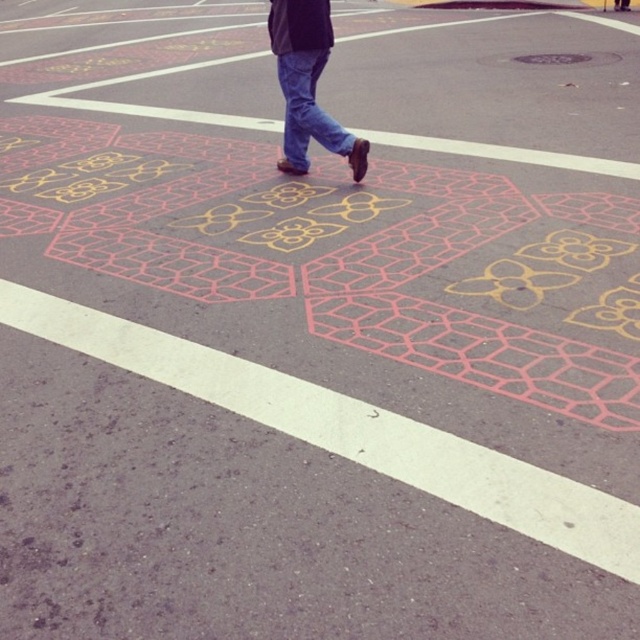
Where is the blue jeans at center located in the image?

The blue jeans at center is located at point (307, 84) in the image.

You are a photographer trying to capture the vibrant patterns on the paved surface. You notice two pairs of jeans at the center of the image. Which pair of jeans, the blue jeans at center or the blue denim jeans at center, is taller?

The blue jeans at center is taller than the blue denim jeans at center.

You are a photographer trying to capture the vibrant patterns on the pavement while ensuring the person in blue jeans at center and blue denim jeans at center are visible. Which pair of jeans should you focus on to ensure they are fully visible in the frame?

The blue jeans at center should be focused on because their width is larger than the blue denim jeans at center, making them more visible in the frame.